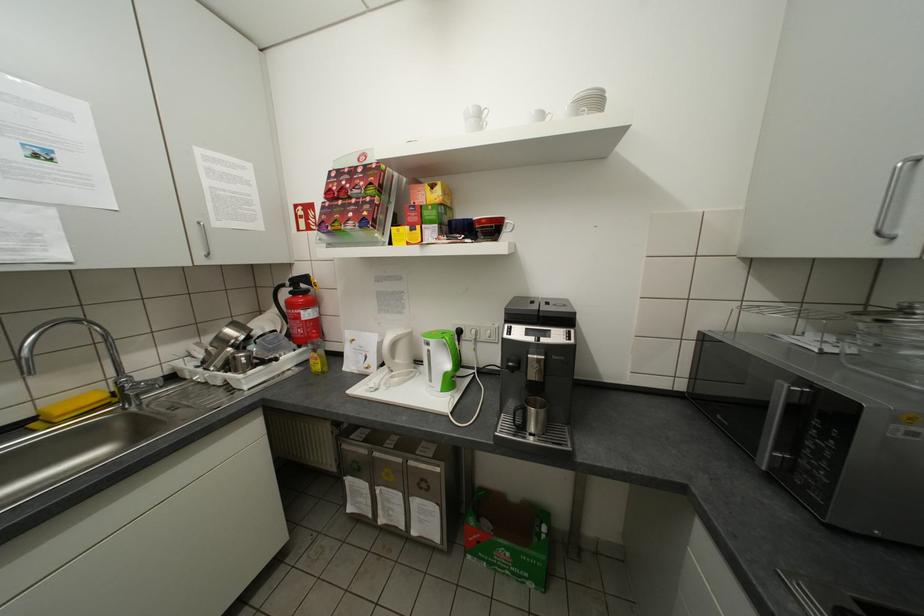
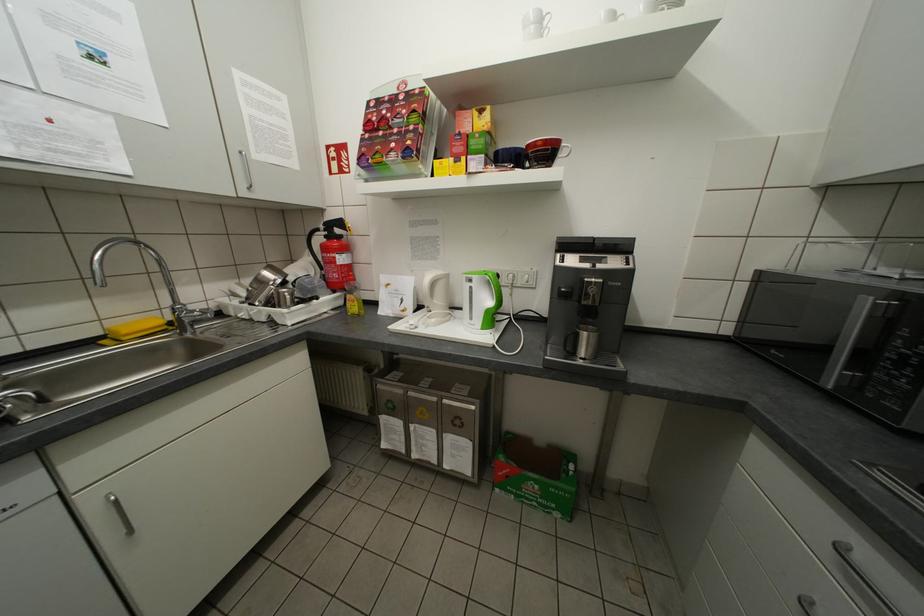
The point at (126, 383) is marked in the first image. Where is the corresponding point in the second image?

(181, 309)